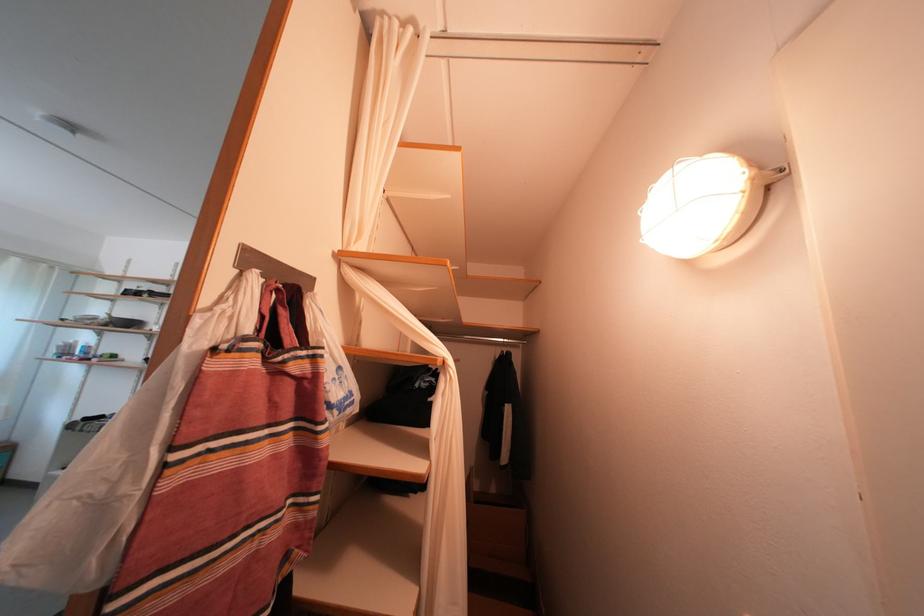
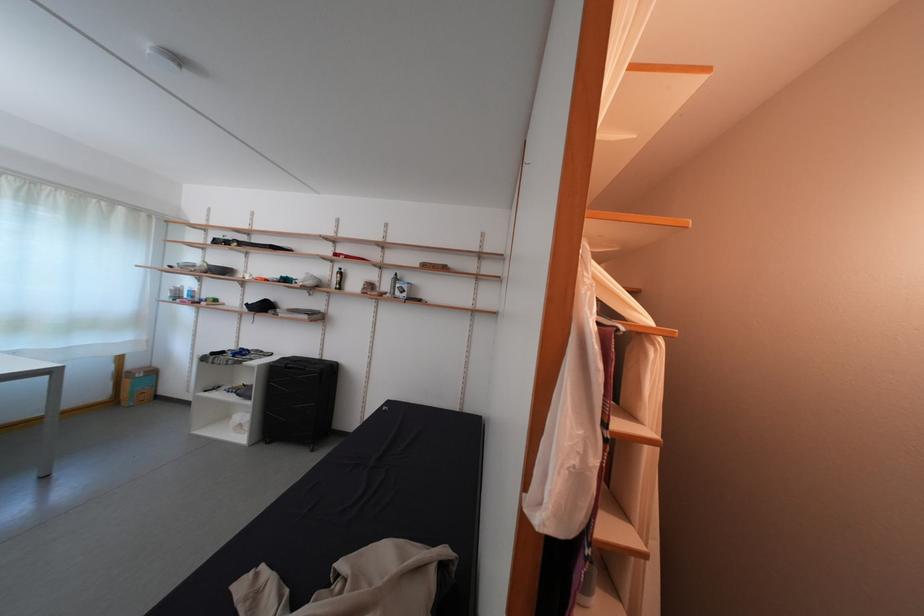
Question: In a continuous first-person perspective shot, in which direction is the camera moving?

Choices:
 (A) Left
 (B) Right
 (C) Forward
 (D) Backward

Answer: (A)